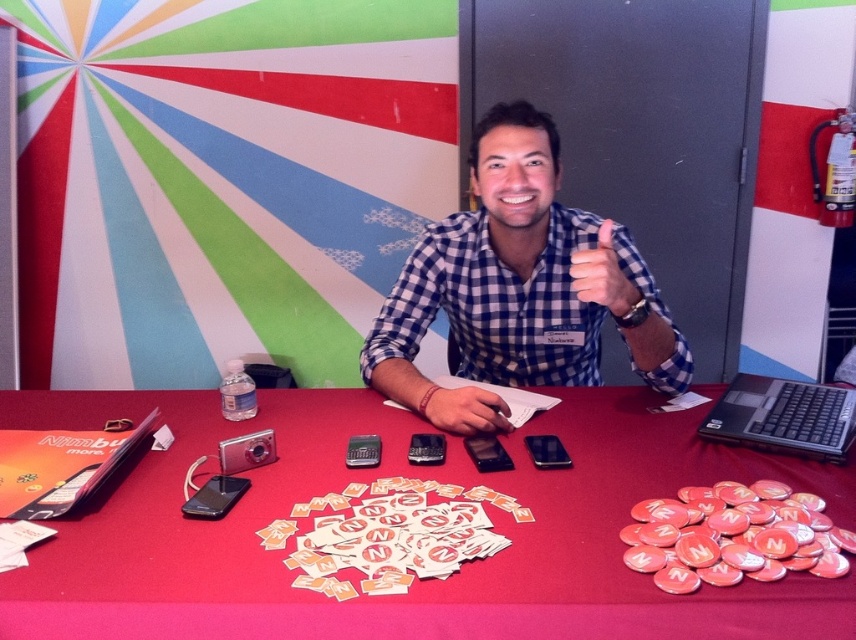
You are organizing a promotional event and need to place a new promotional item on the table. The item must be placed above the matte black mouse at center but below the matte blue checkered shirt at upper center. Is there enough space between these two items to place the new item?

The matte black mouse at center is located below the matte blue checkered shirt at upper center, so there is space between them. However, the exact dimensions of the space aren

You are organizing a tech event and need to place a new gadget between the matte black mouse at center and the matte blue checkered shirt at upper center. Based on their positions, which side of the mouse should you place it to ensure it aligns with the shirt?

The matte black mouse at center is to the left of the matte blue checkered shirt at upper center, so placing the gadget to the right of the matte black mouse at center will align it with the shirt.

You are a photographer standing behind the red table. You need to place a rectangular box that is 12 inches wide on the table. The box must be placed between the black plastic laptop at right and the matte blue checkered shirt at upper center. Can the box fit between them horizontally?

The black plastic laptop at right might be wider than matte blue checkered shirt at upper center, so the 12 inches wide box may not fit between them horizontally if the distance between them is less than 12 inches.